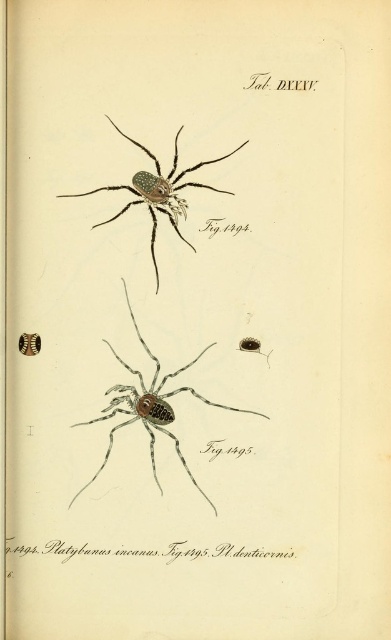
Based on the scene description, which spider has a greater width between the brown matte spider at center and the shiny metallic spider at upper center?

The brown matte spider at center has a greater width than the shiny metallic spider at upper center.

From the picture: You are a collector of arachnid specimens and have a display case with limited space. You need to place both the brown matte spider at center and the shiny metallic spider at upper center. Given their sizes, which spider should you place first to ensure they both fit in the case?

The brown matte spider at center is bigger than the shiny metallic spider at upper center, so you should place the brown matte spider at center first to ensure there is enough space for both.

You are examining a page from a scientific book about spiders. You see a brown matte spider at center and a shiny metallic spider at upper center. Which spider is positioned more to the right side of the page?

The brown matte spider at center is positioned more to the right side of the page than the shiny metallic spider at upper center.